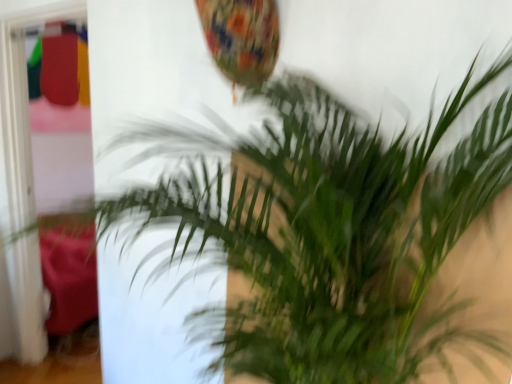
Question: Should I look upward or downward to see transparent glass door at left?

Choices:
 (A) up
 (B) down

Answer: (B)